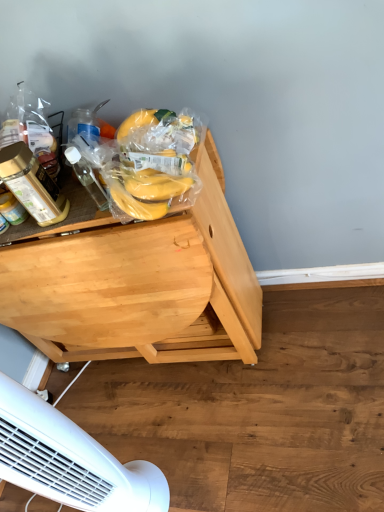
At what (x,y) coordinates should I click in order to perform the action: click on vacant area located to the right-hand side of white plastic mechanical fan at lower left. Please return your answer as a coordinate pair (x, y). Looking at the image, I should click on (193, 458).